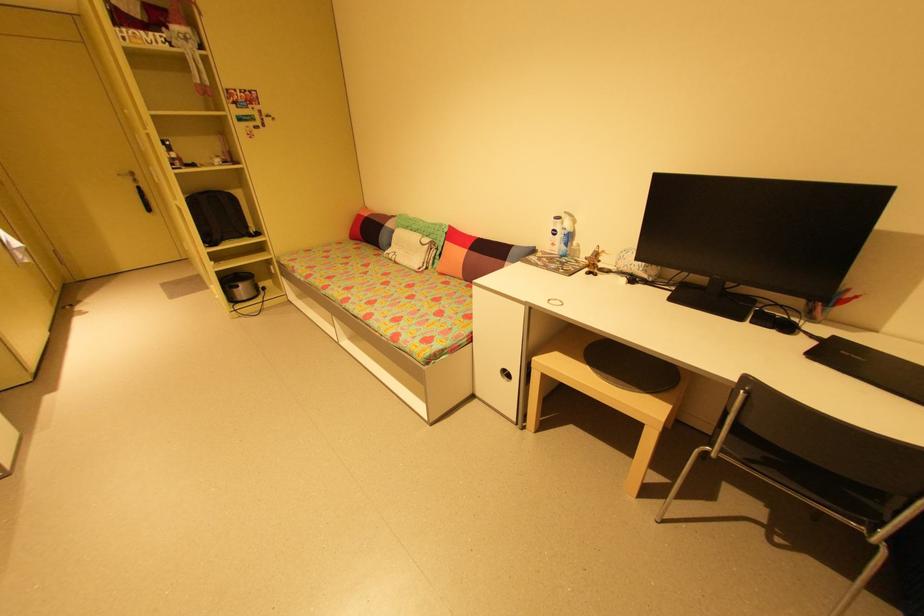
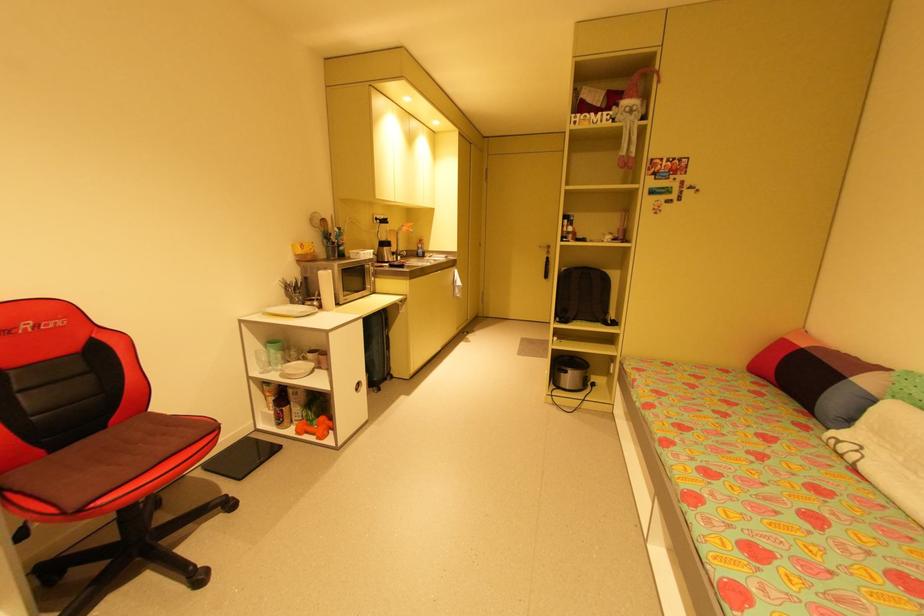
Question: The camera is either moving clockwise (left) or counter-clockwise (right) around the object. The first image is from the beginning of the video and the second image is from the end. Is the camera moving left or right when shooting the video?

Choices:
 (A) Left
 (B) Right

Answer: (B)